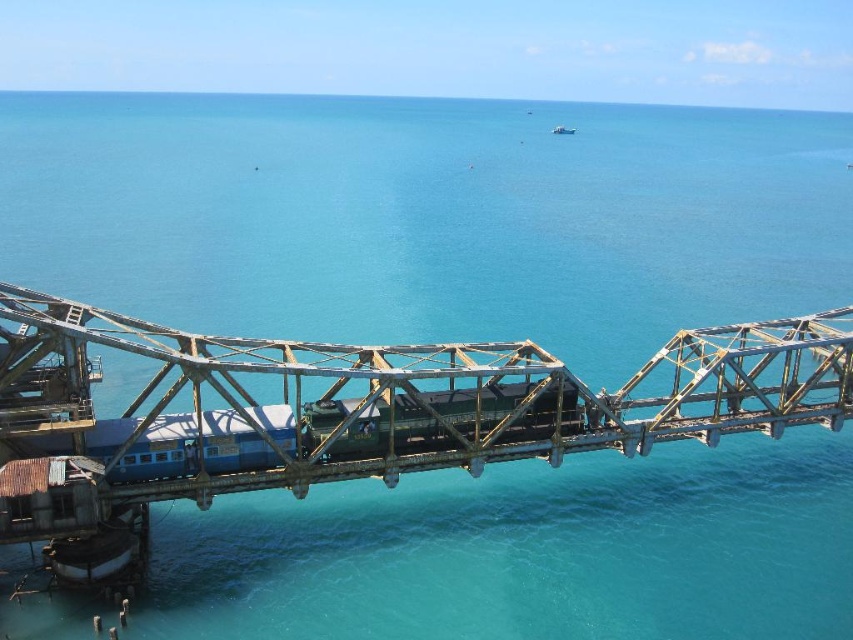
Consider the image. Does rusty metal bridge at center appear over blue painted steel passenger train at center?

Correct, rusty metal bridge at center is located above blue painted steel passenger train at center.

In the scene shown: Between rusty metal bridge at center and blue painted steel passenger train at center, which one is positioned lower?

blue painted steel passenger train at center

The width and height of the screenshot is (853, 640). What do you see at coordinates (363, 406) in the screenshot?
I see `rusty metal bridge at center` at bounding box center [363, 406].

Find the location of a particular element. rusty metal bridge at center is located at coordinates (363, 406).